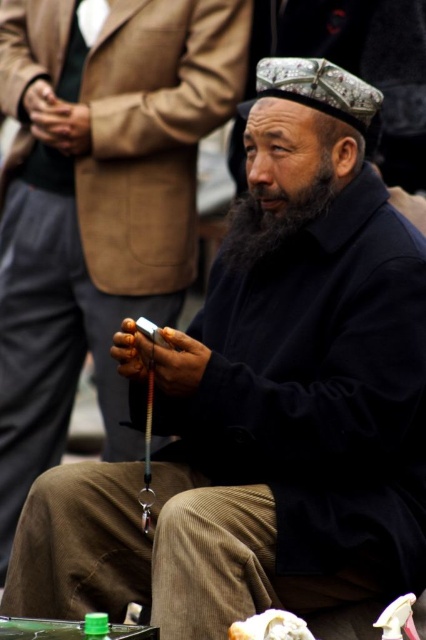
You are a photographer taking a portrait of the man with the black fuzzy beard at center and the white fluffy bread at lower center. Which object is positioned higher in the frame?

The black fuzzy beard at center is positioned higher than the white fluffy bread at lower center.

Consider the image. You are a photographer standing at the edge of the scene. You need to take a closeup photo of the black fuzzy beard at center and the white fluffy bread at lower center. Can you capture both in one shot without moving your camera? Please explain based on their distance.

The distance between the black fuzzy beard at center and the white fluffy bread at lower center is 6.88 meters. Since the photographer is at the edge of the scene, capturing both in one shot without moving the camera would require a wide enough lens to cover 6.88 meters between them. However, typical closeup photography uses a narrow field of view, making it unlikely without moving the camera or using specialized equipment.